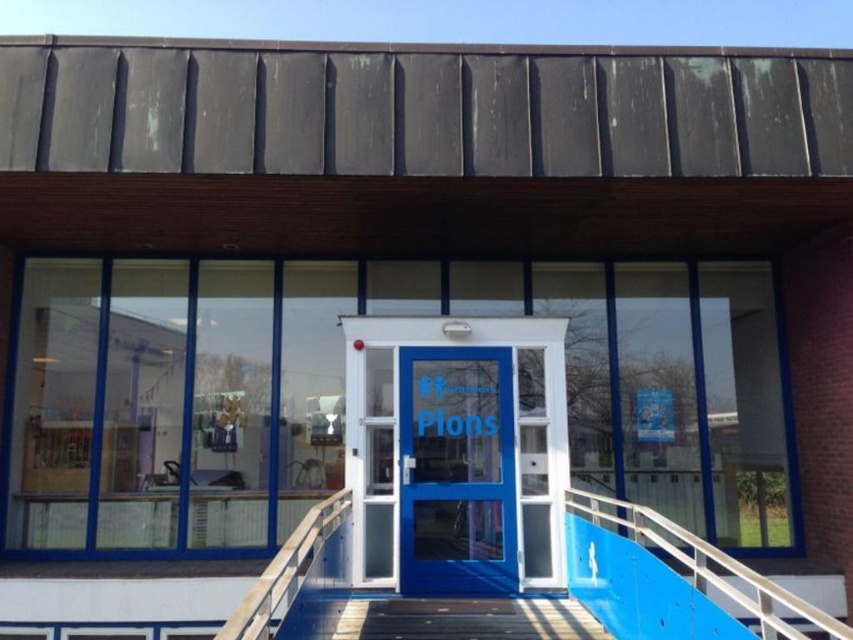
Question: Is blue metallic handrail at lower right further to the viewer compared to white plastic rail at center?

Choices:
 (A) yes
 (B) no

Answer: (B)

Question: Which of these objects is positioned closest to the white plastic rail at center?

Choices:
 (A) blue glossy door at center
 (B) blue metallic handrail at lower right

Answer: (A)

Question: Is blue metallic handrail at lower right smaller than white plastic rail at center?

Choices:
 (A) yes
 (B) no

Answer: (B)

Question: Is blue glossy door at center smaller than white plastic rail at center?

Choices:
 (A) no
 (B) yes

Answer: (A)

Question: Which point is closer to the camera taking this photo?

Choices:
 (A) (705, 556)
 (B) (279, 573)
 (C) (497, 538)

Answer: (B)

Question: Which point appears closest to the camera in this image?

Choices:
 (A) (413, 380)
 (B) (611, 520)
 (C) (293, 532)

Answer: (B)